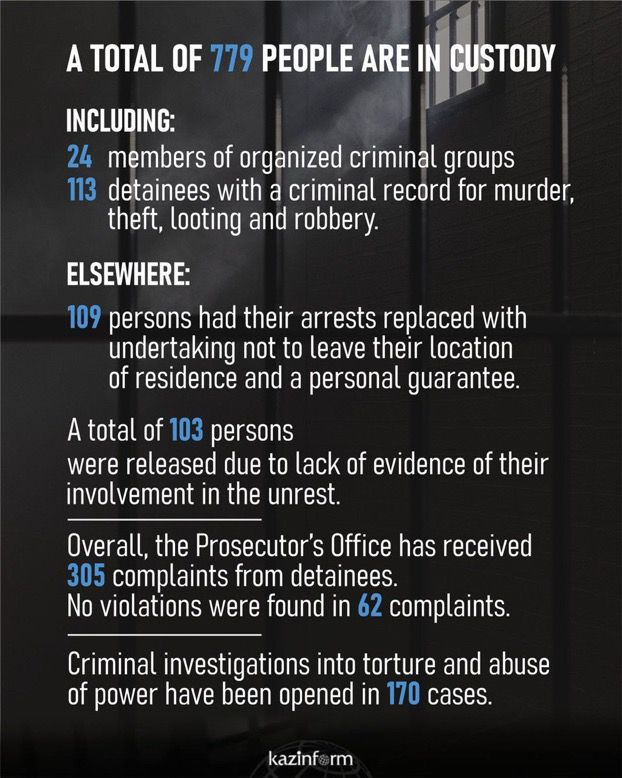
You are a GUI agent. You are given a task and a screenshot of the screen. Output one action in this format:
    pyautogui.click(x=<x>, y=<y>)
    Task: Click on the window
    The image size is (622, 778).
    Given the screenshot: What is the action you would take?
    pyautogui.click(x=445, y=76)